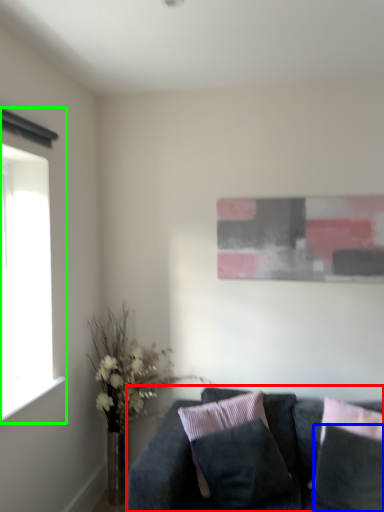
Question: Which object is the closest to the studio couch (highlighted by a red box)? Choose among these: pillow (highlighted by a blue box) or window (highlighted by a green box).

Choices:
 (A) pillow
 (B) window

Answer: (A)